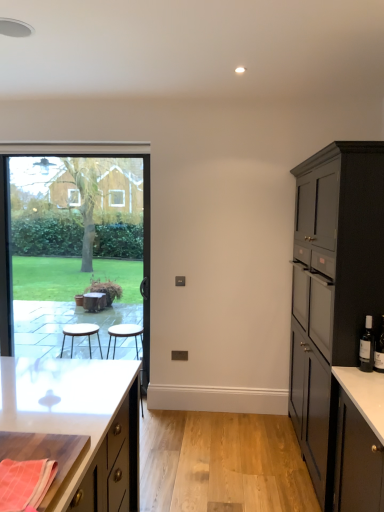
Question: Is wooden cutting board at lower left, the second cabinetry from the right, taller than matte black cabinet at right, positioned as the second cabinetry in left-to-right order?

Choices:
 (A) yes
 (B) no

Answer: (B)

Question: From a real-world perspective, is wooden cutting board at lower left, which ranks as the first cabinetry in left-to-right order, under matte black cabinet at right, marked as the 1th cabinetry in a right-to-left arrangement?

Choices:
 (A) no
 (B) yes

Answer: (B)

Question: From the image's perspective, is wooden cutting board at lower left, which ranks as the first cabinetry in left-to-right order, over matte black cabinet at right, marked as the 1th cabinetry in a right-to-left arrangement?

Choices:
 (A) no
 (B) yes

Answer: (A)

Question: Are wooden cutting board at lower left, the second cabinetry from the right, and matte black cabinet at right, positioned as the second cabinetry in left-to-right order, beside each other?

Choices:
 (A) yes
 (B) no

Answer: (B)

Question: From the image's perspective, is wooden cutting board at lower left, which ranks as the first cabinetry in left-to-right order, beneath matte black cabinet at right, positioned as the second cabinetry in left-to-right order?

Choices:
 (A) yes
 (B) no

Answer: (A)

Question: In terms of width, does dark glass wine bottle at right look wider or thinner when compared to black glass bottle at right?

Choices:
 (A) wide
 (B) thin

Answer: (B)

Question: From their relative heights in the image, would you say dark glass wine bottle at right is taller or shorter than black glass bottle at right?

Choices:
 (A) short
 (B) tall

Answer: (B)

Question: Considering the positions of point (380, 355) and point (372, 346), is point (380, 355) closer or farther from the camera than point (372, 346)?

Choices:
 (A) closer
 (B) farther

Answer: (A)

Question: Looking at the image, does dark glass wine bottle at right seem bigger or smaller compared to black glass bottle at right?

Choices:
 (A) small
 (B) big

Answer: (A)

Question: Is transparent glass window at left bigger or smaller than wooden stool at center?

Choices:
 (A) small
 (B) big

Answer: (B)

Question: Is transparent glass window at left wider or thinner than wooden stool at center?

Choices:
 (A) wide
 (B) thin

Answer: (B)

Question: From the image's perspective, is transparent glass window at left positioned above or below wooden stool at center?

Choices:
 (A) below
 (B) above

Answer: (B)

Question: From a real-world perspective, relative to wooden stool at center, is transparent glass window at left vertically above or below?

Choices:
 (A) below
 (B) above

Answer: (B)

Question: From a real-world perspective, is wooden cutting board at lower left, the second cabinetry from the right, above or below orange woven cloth at lower left?

Choices:
 (A) below
 (B) above

Answer: (A)

Question: From the image's perspective, is wooden cutting board at lower left, which ranks as the first cabinetry in left-to-right order, located above or below orange woven cloth at lower left?

Choices:
 (A) above
 (B) below

Answer: (B)